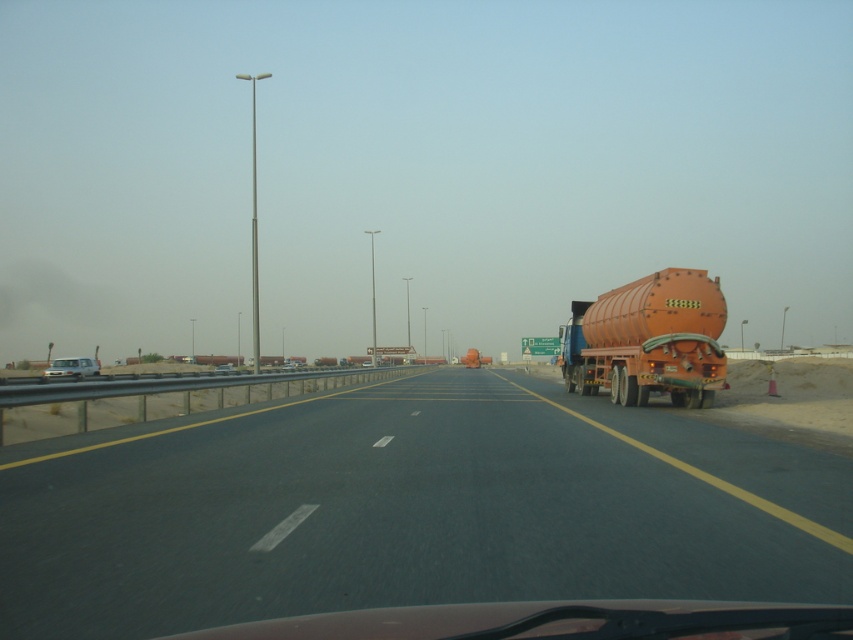
You are a delivery driver approaching the highway. You see two points marked on your GPS navigation screen. The first point is labeled as point (656,582) and the second is point (57,371). According to the image, which point is closer to the front of the highway?

Point (656,582) is in front of point (57,371), so the first point is closer to the front of the highway.

You are a delivery driver who needs to make an emergency stop on the highway. You see the asphalt road at center at point (409, 509). Is this location suitable for stopping your vehicle?

The asphalt road at center at point (409, 509) is suitable for stopping because it is a clear section of the highway, free from obstructions like the orange tanker truck on the right or the metal guardrail on the left. However, ensure there is enough space and no oncoming traffic before stopping.

You are a delivery driver approaching the highway. Your GPS shows a destination marker at point (126, 483). If your vehicle is 5 meters long, will you be able to stop completely before reaching that point?

The point (126, 483) is 10.49 meters away from the camera. Since your vehicle is 5 meters long, you need at least 10.49 meters to stop safely. Therefore, you have enough space to stop before reaching the point.